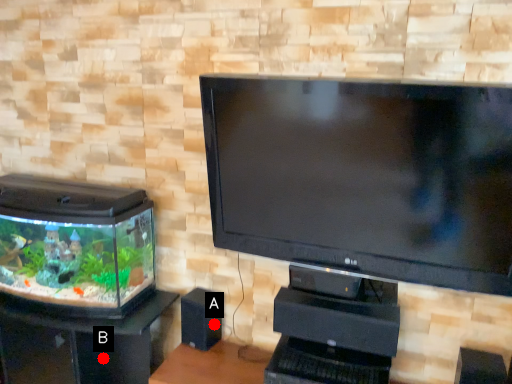
Question: Two points are circled on the image, labeled by A and B beside each circle. Which point is farther to the camera?

Choices:
 (A) A is further
 (B) B is further

Answer: (B)